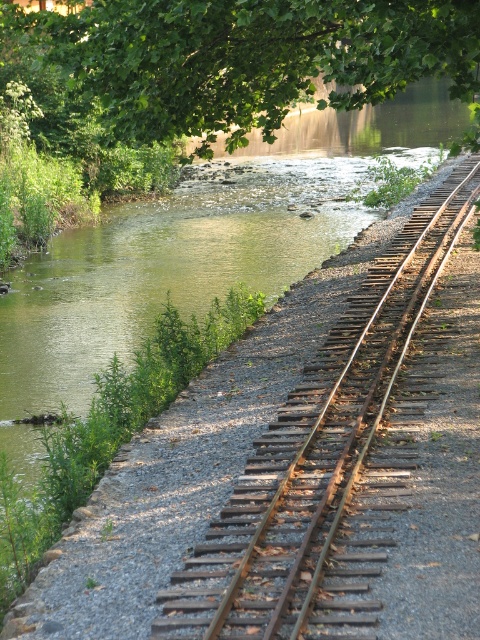
Consider the image. You are standing at the point marked by the coordinates point (321, 458). Which object from the scene is located to your immediate right?

The rusty metal train track at right is located to your immediate right as it is represented by the coordinates point (321, 458).

You are standing at the origin point of the image. A rusty metal train track at right is located at coordinates 0.717, 0.669. If you want to reach it, in which direction should you move?

The rusty metal train track at right is located at coordinates (321, 458), so you should move towards the right and downward direction to reach it.